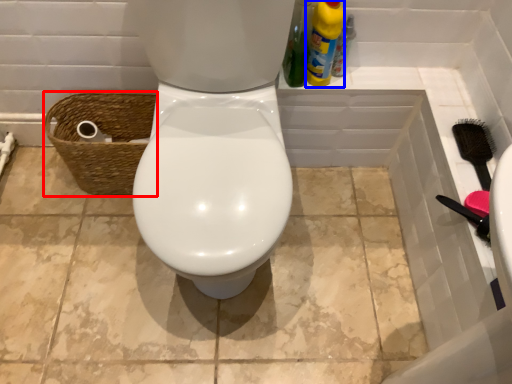
Question: Which object appears closest to the camera in this image, basket (highlighted by a red box) or cleaning product (highlighted by a blue box)?

Choices:
 (A) basket
 (B) cleaning product

Answer: (B)